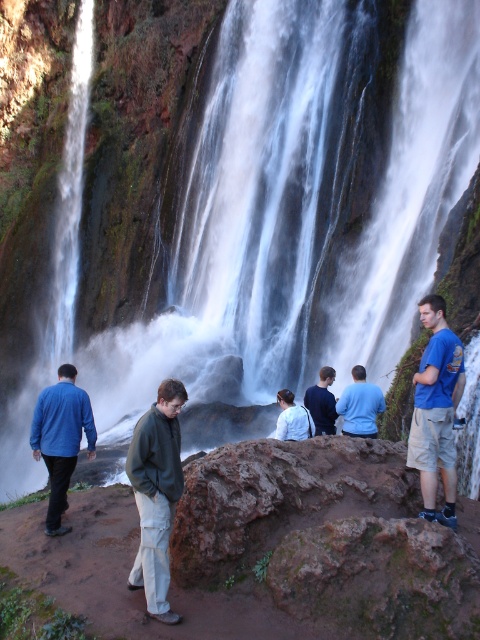
Does point (432, 307) lie in front of point (312, 401)?

Yes, it is in front of point (312, 401).

Can you confirm if blue t-shirt at center-right is positioned below dark blue shirt at center?

No, blue t-shirt at center-right is not below dark blue shirt at center.

Does point (436, 336) come farther from viewer compared to point (314, 433)?

No, (436, 336) is in front of (314, 433).

Locate an element on the screen. blue t-shirt at center-right is located at coordinates (435, 410).

Does blue cotton jacket at left appear over blue cotton shirt at center?

No, blue cotton jacket at left is not above blue cotton shirt at center.

Which of these two, blue cotton jacket at left or blue cotton shirt at center, stands taller?

Standing taller between the two is blue cotton jacket at left.

What are the coordinates of `blue cotton jacket at left` in the screenshot? It's located at (60, 438).

Can you confirm if blue cotton jacket at left is positioned below white matte jacket at center?

No.

Between point (60, 512) and point (298, 406), which one is positioned behind?

Positioned behind is point (298, 406).

Find the location of a particular element. The width and height of the screenshot is (480, 640). blue cotton jacket at left is located at coordinates (60, 438).